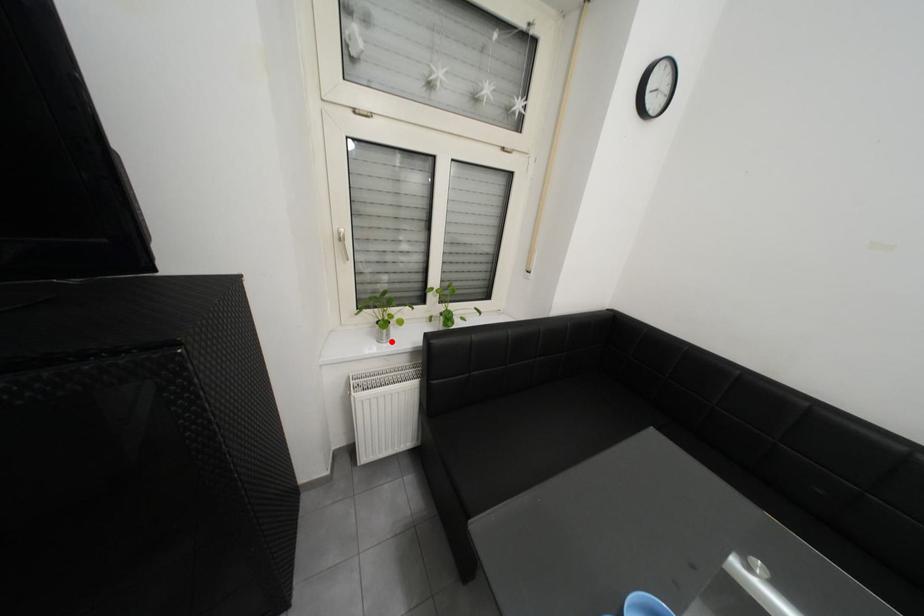
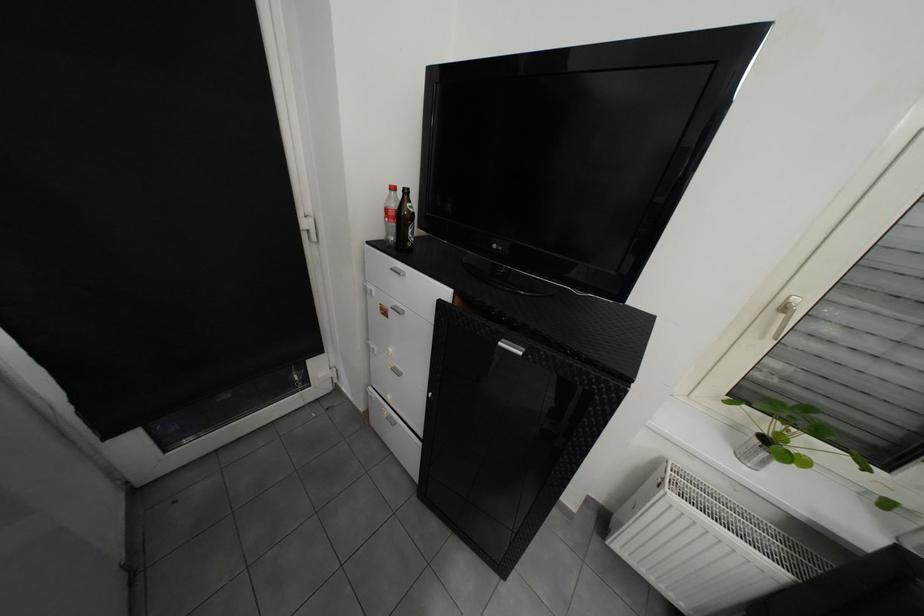
Find the pixel in the second image that matches the highlighted location in the first image.

(754, 458)